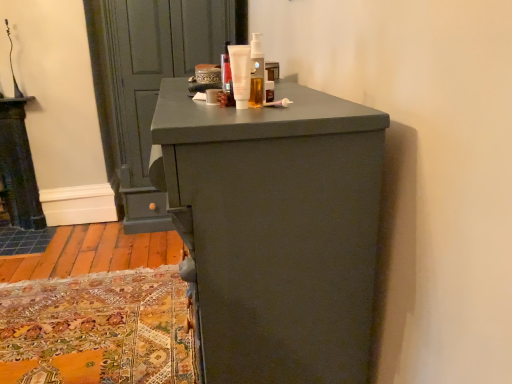
The image size is (512, 384). Identify the location of spots to the right of white matte tube at center, positioned as the 2th toiletry in right-to-left order. (302, 103).